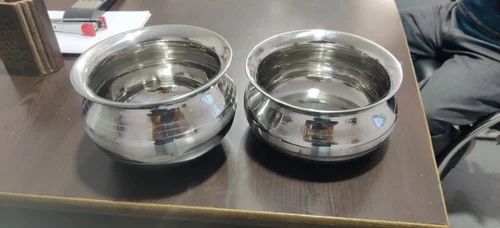
In order to click on bowls in this screenshot , I will do `click(332, 94)`, `click(157, 85)`.